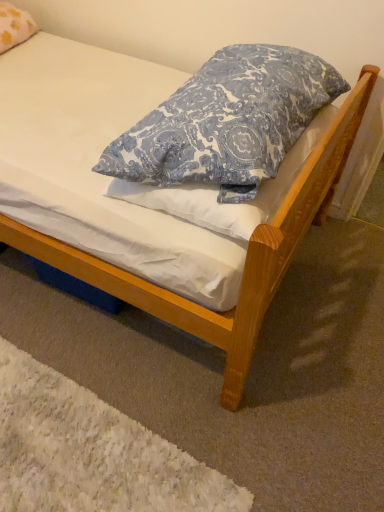
The image size is (384, 512). I want to click on blue printed pillow at center, so click(x=227, y=122).

Image resolution: width=384 pixels, height=512 pixels. Describe the element at coordinates (227, 122) in the screenshot. I see `blue printed pillow at center` at that location.

Image resolution: width=384 pixels, height=512 pixels. I want to click on blue printed pillow at center, so click(227, 122).